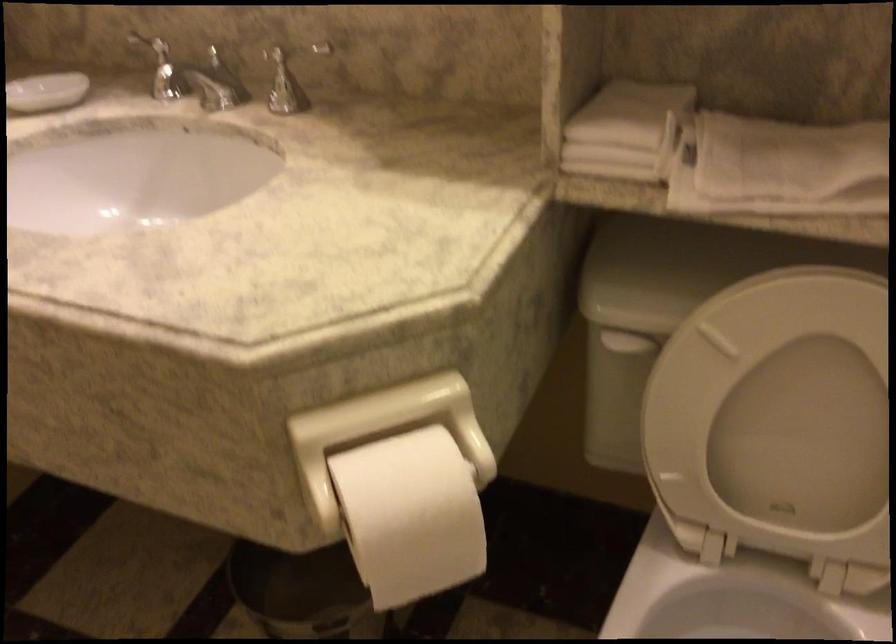
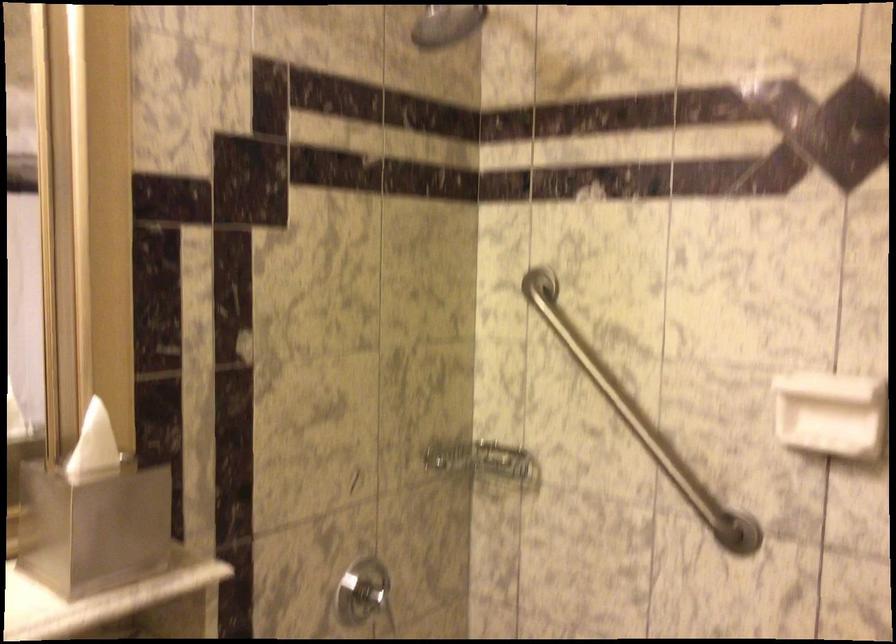
Question: Based on the continuous images, in which direction is the camera rotating? Reply with the corresponding letter.

Choices:
 (A) Left
 (B) Right
 (C) Up
 (D) Down

Answer: (B)